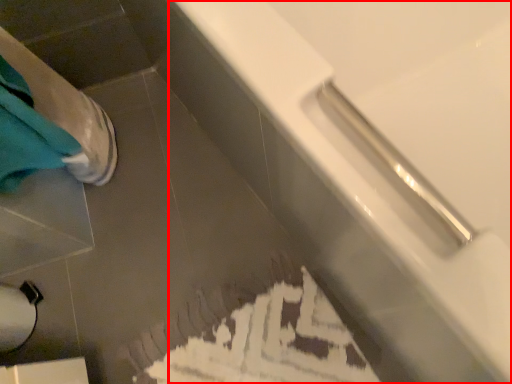
Question: From the image's perspective, what is the correct spatial positioning of bathtub (annotated by the red box) in reference to toilet paper?

Choices:
 (A) below
 (B) above

Answer: (B)